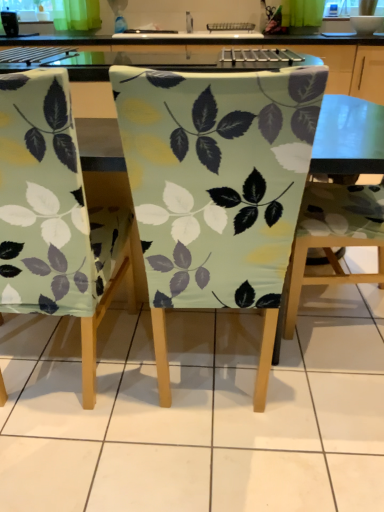
Question: Is matte fabric chair at center, which is the second chair from right to left, far away from matte green fabric chair at center, the 3th chair from the right?

Choices:
 (A) no
 (B) yes

Answer: (A)

Question: From a real-world perspective, is matte fabric chair at center, which is the second chair from right to left, positioned over matte green fabric chair at center, the 3th chair from the right, based on gravity?

Choices:
 (A) no
 (B) yes

Answer: (B)

Question: From a real-world perspective, is matte fabric chair at center, which is the second chair from right to left, positioned under matte green fabric chair at center, which ranks as the 1th chair in left-to-right order, based on gravity?

Choices:
 (A) yes
 (B) no

Answer: (B)

Question: Would you say matte green fabric chair at center, which ranks as the 1th chair in left-to-right order, is part of matte fabric chair at center, which is the second chair from right to left,'s contents?

Choices:
 (A) no
 (B) yes

Answer: (A)

Question: Is the position of matte fabric chair at center, the 2th chair when ordered from left to right, less distant than that of matte green fabric chair at center, the 3th chair from the right?

Choices:
 (A) yes
 (B) no

Answer: (A)

Question: Is matte fabric chair at center, the 2th chair when ordered from left to right, behind matte green fabric chair at center, which ranks as the 1th chair in left-to-right order?

Choices:
 (A) no
 (B) yes

Answer: (A)

Question: Is matte green fabric chair at center, which ranks as the 1th chair in left-to-right order, behind matte fabric chair at center, the 2th chair when ordered from left to right?

Choices:
 (A) yes
 (B) no

Answer: (A)

Question: Is matte green fabric chair at center, which ranks as the 1th chair in left-to-right order, thinner than matte fabric chair at center, which is the second chair from right to left?

Choices:
 (A) yes
 (B) no

Answer: (B)

Question: Is matte green fabric chair at center, the 3th chair from the right, smaller than matte fabric chair at center, the 2th chair when ordered from left to right?

Choices:
 (A) no
 (B) yes

Answer: (B)

Question: From a real-world perspective, is matte green fabric chair at center, which ranks as the 1th chair in left-to-right order, physically above matte fabric chair at center, which is the second chair from right to left?

Choices:
 (A) yes
 (B) no

Answer: (B)

Question: Can you confirm if matte green fabric chair at center, which ranks as the 1th chair in left-to-right order, is positioned to the left of matte fabric chair at center, which is the second chair from right to left?

Choices:
 (A) no
 (B) yes

Answer: (B)

Question: Is matte green fabric chair at center, the 3th chair from the right, placed right next to matte fabric chair at center, the 2th chair when ordered from left to right?

Choices:
 (A) no
 (B) yes

Answer: (A)

Question: Is matte fabric chair at center, which is the second chair from right to left, surrounding matte fabric chair at center, which is counted as the 3th chair, starting from the left?

Choices:
 (A) yes
 (B) no

Answer: (B)